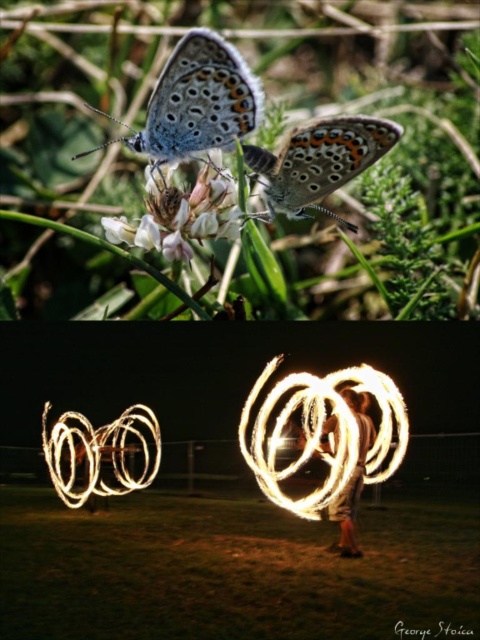
Question: Does green grass at lower center have a larger size compared to shiny metallic butterfly at upper center?

Choices:
 (A) yes
 (B) no

Answer: (A)

Question: Which point appears farthest from the camera in this image?

Choices:
 (A) (443, 545)
 (B) (217, 76)
 (C) (360, 493)

Answer: (C)

Question: Which point appears closest to the camera in this image?

Choices:
 (A) (232, 214)
 (B) (272, 205)

Answer: (A)

Question: Can you confirm if shiny metallic blue butterfly at upper left is thinner than white matte flower at upper center?

Choices:
 (A) yes
 (B) no

Answer: (B)

Question: Based on their relative distances, which object is nearer to the fire spinner at center?

Choices:
 (A) shiny metallic butterfly at upper center
 (B) green grass at lower center
 (C) shiny metallic blue butterfly at upper left
 (D) white matte flower at upper center

Answer: (B)

Question: Is shiny metallic butterfly at upper center closer to the viewer compared to fire spinner at center?

Choices:
 (A) no
 (B) yes

Answer: (A)